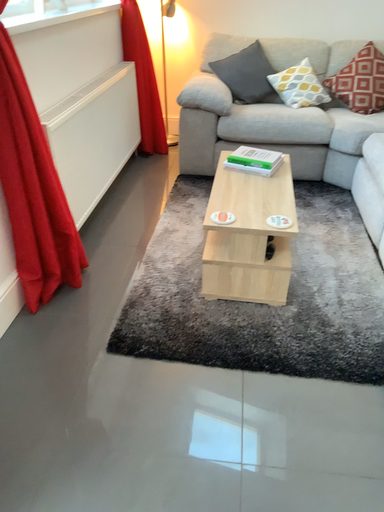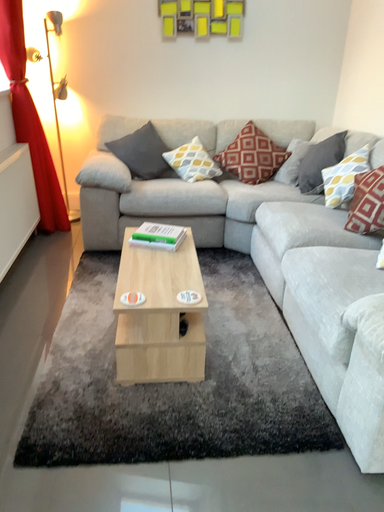
Question: Which way did the camera rotate in the video?

Choices:
 (A) rotated left
 (B) rotated right

Answer: (B)